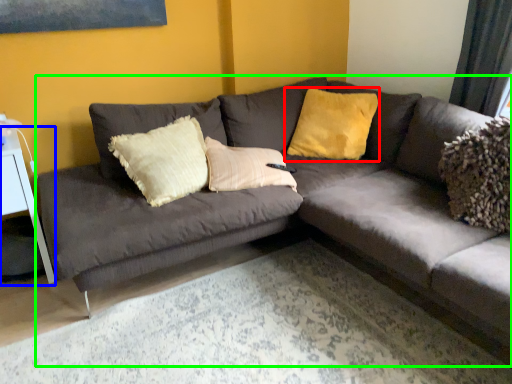
Question: Based on their relative distances, which object is nearer to pillow (highlighted by a red box)? Choose from table (highlighted by a blue box) and studio couch (highlighted by a green box).

Choices:
 (A) table
 (B) studio couch

Answer: (B)